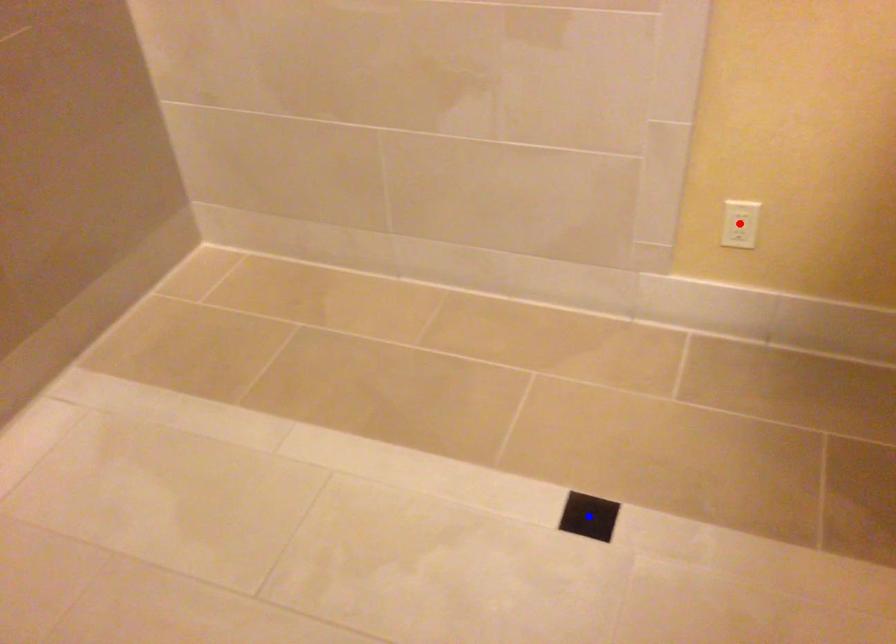
Question: Which of the two points in the image is closer to the camera?

Choices:
 (A) Blue point is closer.
 (B) Red point is closer.

Answer: (A)